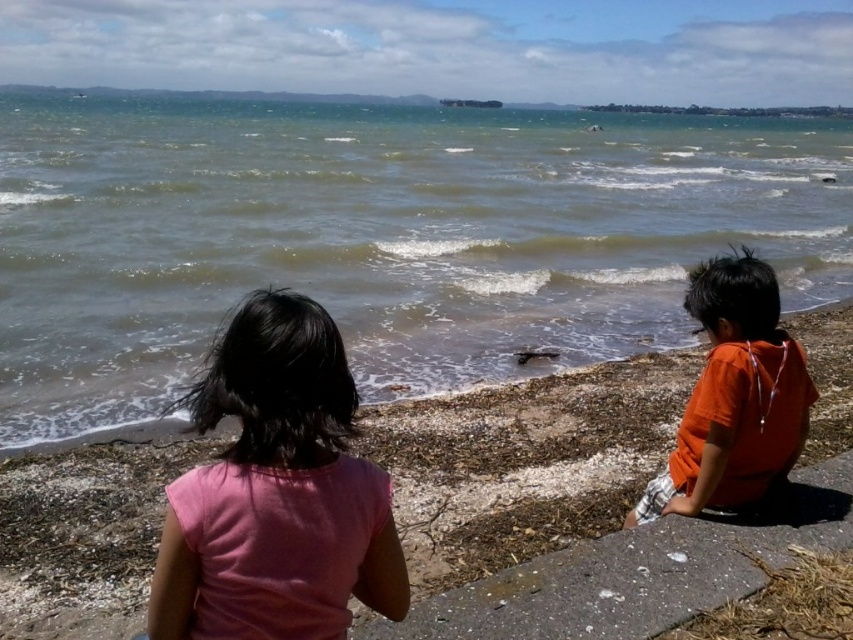
Question: Which point is closer to the camera taking this photo?

Choices:
 (A) (238, 522)
 (B) (274, 196)
 (C) (712, 323)

Answer: (A)

Question: Can you confirm if white concrete stone at lower right is smaller than orange cotton shirt at right?

Choices:
 (A) yes
 (B) no

Answer: (B)

Question: Does pink fabric shirt at center have a lesser width compared to orange cotton shirt at right?

Choices:
 (A) no
 (B) yes

Answer: (B)

Question: Considering the real-world distances, which object is farthest from the white concrete stone at lower right?

Choices:
 (A) blue water at center
 (B) pink fabric shirt at center

Answer: (A)

Question: Where is blue water at center located in relation to white concrete stone at lower right in the image?

Choices:
 (A) above
 (B) below

Answer: (A)

Question: Based on their relative distances, which object is nearer to the pink fabric shirt at center?

Choices:
 (A) blue water at center
 (B) white concrete stone at lower right
 (C) orange cotton shirt at right

Answer: (B)